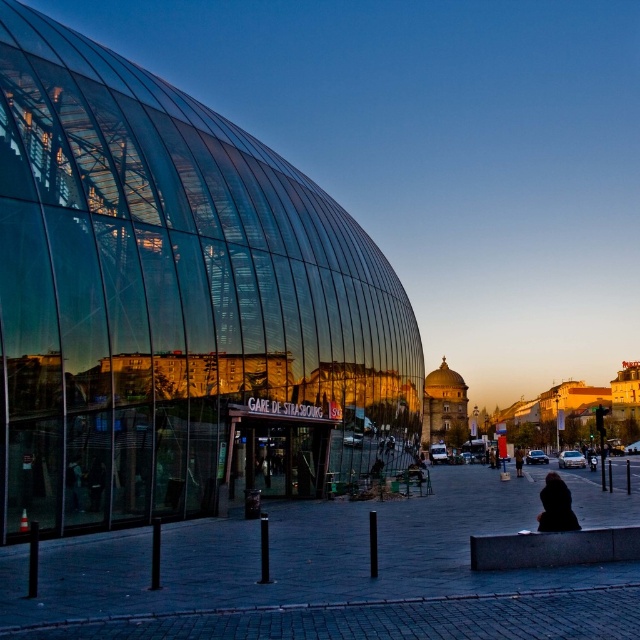
Question: Among these points, which one is nearest to the camera?

Choices:
 (A) (385, 388)
 (B) (522, 451)
 (C) (547, 512)

Answer: (C)

Question: Is granite bench at lower right to the right of dark brown leather jacket at center from the viewer's perspective?

Choices:
 (A) no
 (B) yes

Answer: (A)

Question: Does transparent glass building at left have a smaller size compared to black matte coat at lower right?

Choices:
 (A) no
 (B) yes

Answer: (A)

Question: Among these objects, which one is farthest from the camera?

Choices:
 (A) granite bench at lower right
 (B) dark brown leather jacket at center

Answer: (B)

Question: In this image, where is transparent glass building at left located relative to granite bench at lower right?

Choices:
 (A) left
 (B) right

Answer: (A)

Question: Among these objects, which one is nearest to the camera?

Choices:
 (A) transparent glass building at left
 (B) black matte coat at lower right

Answer: (A)